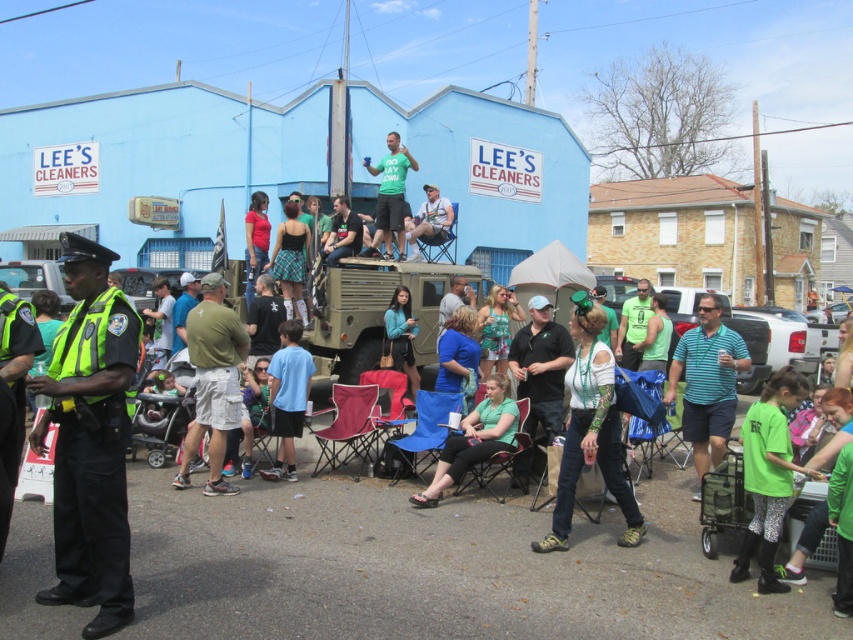
Is green striped polo shirt at center thinner than teal fabric jacket at center?

Incorrect, green striped polo shirt at center's width is not less than teal fabric jacket at center's.

I want to click on green striped polo shirt at center, so click(706, 381).

Where is `green striped polo shirt at center`? green striped polo shirt at center is located at coordinates (706, 381).

Can you confirm if green reflective vest at left is taller than denim jeans at center?

Correct, green reflective vest at left is much taller as denim jeans at center.

Can you confirm if green reflective vest at left is positioned to the right of denim jeans at center?

No, green reflective vest at left is not to the right of denim jeans at center.

Who is more forward, (78,256) or (585,410)?

Positioned in front is point (78,256).

The height and width of the screenshot is (640, 853). What are the coordinates of `green reflective vest at left` in the screenshot? It's located at point(90,440).

Which is more to the right, green reflective vest at left or green striped polo shirt at center?

green striped polo shirt at center is more to the right.

Is point (56, 461) closer to viewer compared to point (698, 301)?

Yes.

What are the coordinates of `green reflective vest at left` in the screenshot? It's located at (90, 440).